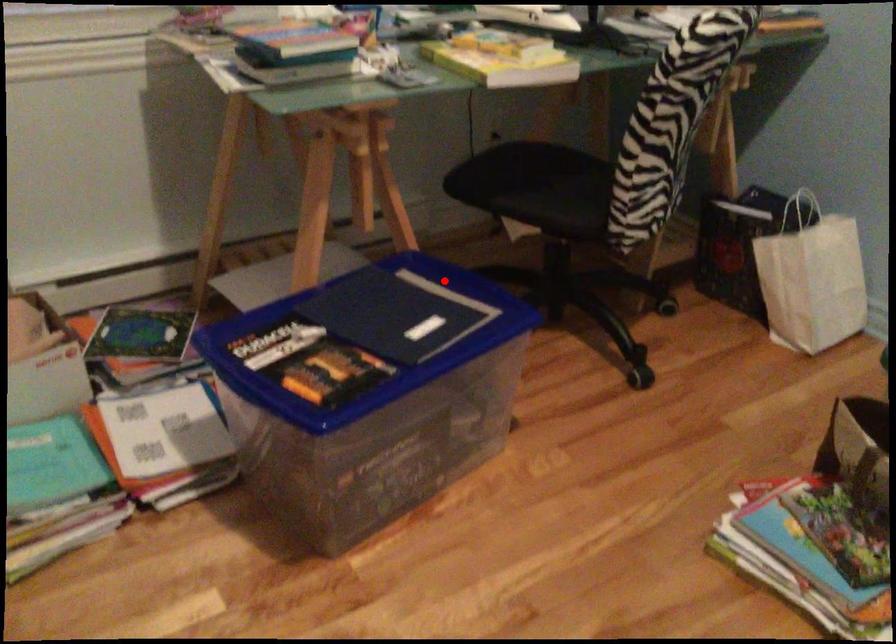
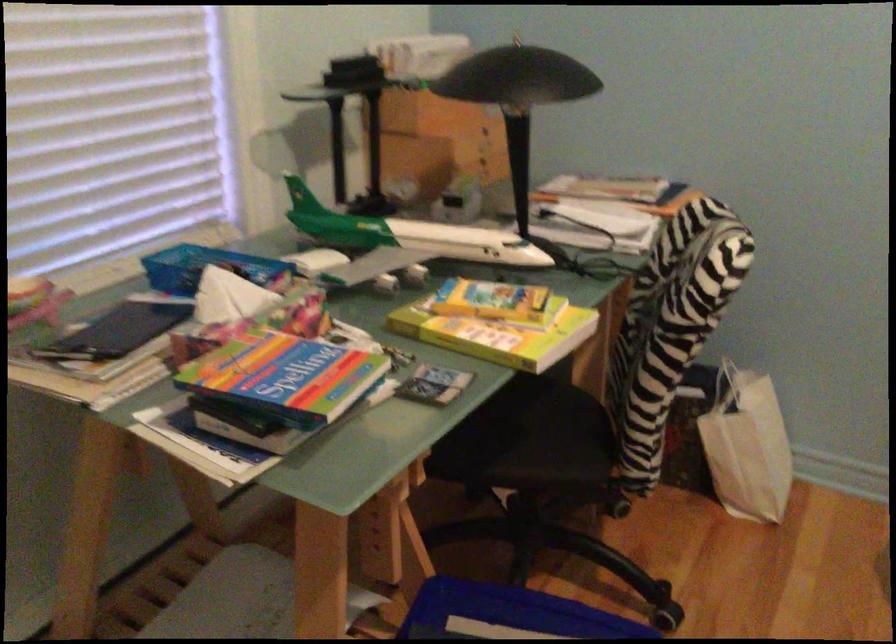
The point at the highlighted location is marked in the first image. Where is the corresponding point in the second image?

(507, 614)